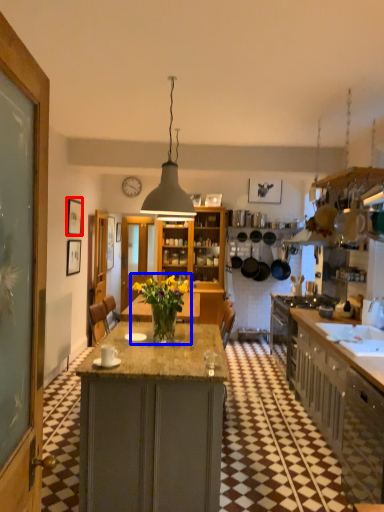
Question: Which point is closer to the camera, picture frame (highlighted by a red box) or houseplant (highlighted by a blue box)?

Choices:
 (A) picture frame
 (B) houseplant

Answer: (B)